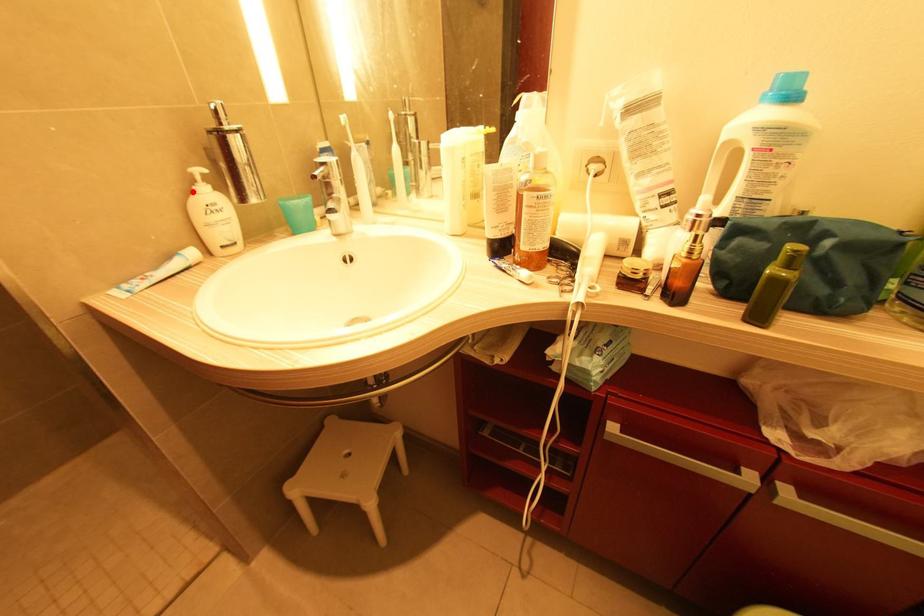
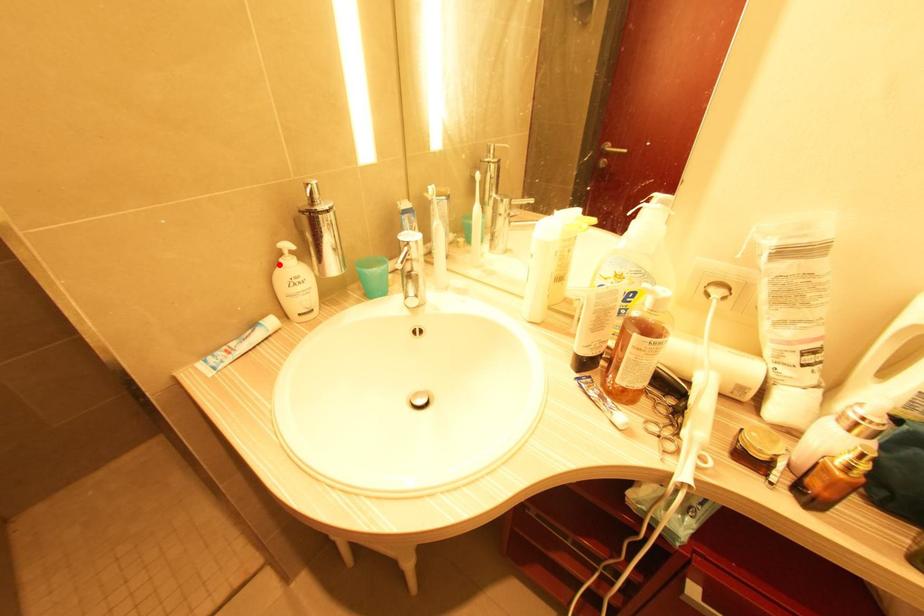
I am providing you with two images of the same scene from different viewpoints. A red point is marked on the first image and another point is marked on the second image. Does the point marked in image1 correspond to the same location as the one in image2?

Yes